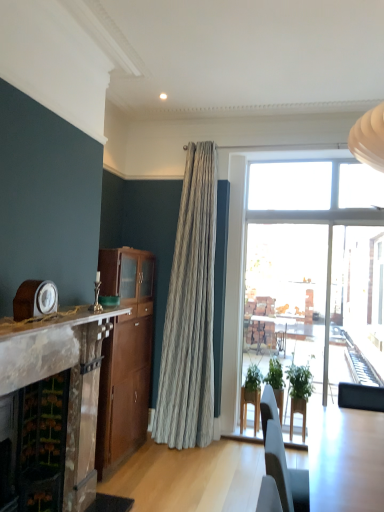
Question: In which direction should I rotate to look at green leafy plant at center, which is the 1th houseplant from right to left?

Choices:
 (A) left
 (B) right

Answer: (B)

Question: From a real-world perspective, is wooden cabinet at center physically above green leafy plant at center, arranged as the second houseplant when viewed from the left?

Choices:
 (A) no
 (B) yes

Answer: (B)

Question: Is wooden cabinet at center facing towards green leafy plant at center, which is the 1th houseplant from right to left?

Choices:
 (A) yes
 (B) no

Answer: (B)

Question: From the image's perspective, would you say wooden cabinet at center is shown under green leafy plant at center, which is the 1th houseplant from right to left?

Choices:
 (A) yes
 (B) no

Answer: (B)

Question: Is wooden cabinet at center wider than green leafy plant at center, arranged as the second houseplant when viewed from the left?

Choices:
 (A) no
 (B) yes

Answer: (B)

Question: Is the depth of wooden cabinet at center greater than that of green leafy plant at center, which is the 1th houseplant from right to left?

Choices:
 (A) yes
 (B) no

Answer: (B)

Question: Considering the relative sizes of wooden cabinet at center and green leafy plant at center, arranged as the second houseplant when viewed from the left, in the image provided, is wooden cabinet at center thinner than green leafy plant at center, arranged as the second houseplant when viewed from the left,?

Choices:
 (A) no
 (B) yes

Answer: (A)

Question: Can you confirm if marble fireplace at left is shorter than marble mantel at left?

Choices:
 (A) yes
 (B) no

Answer: (B)

Question: From the image's perspective, is marble fireplace at left above marble mantel at left?

Choices:
 (A) yes
 (B) no

Answer: (B)

Question: Does marble fireplace at left appear on the right side of marble mantel at left?

Choices:
 (A) yes
 (B) no

Answer: (B)

Question: Does marble fireplace at left have a larger size compared to marble mantel at left?

Choices:
 (A) yes
 (B) no

Answer: (A)

Question: From the image's perspective, would you say marble fireplace at left is shown under marble mantel at left?

Choices:
 (A) no
 (B) yes

Answer: (B)

Question: Is marble fireplace at left completely or partially outside of marble mantel at left?

Choices:
 (A) yes
 (B) no

Answer: (A)

Question: Is wooden cabinet at center wider than green matte plant at center, which ranks as the first houseplant in left-to-right order?

Choices:
 (A) no
 (B) yes

Answer: (B)